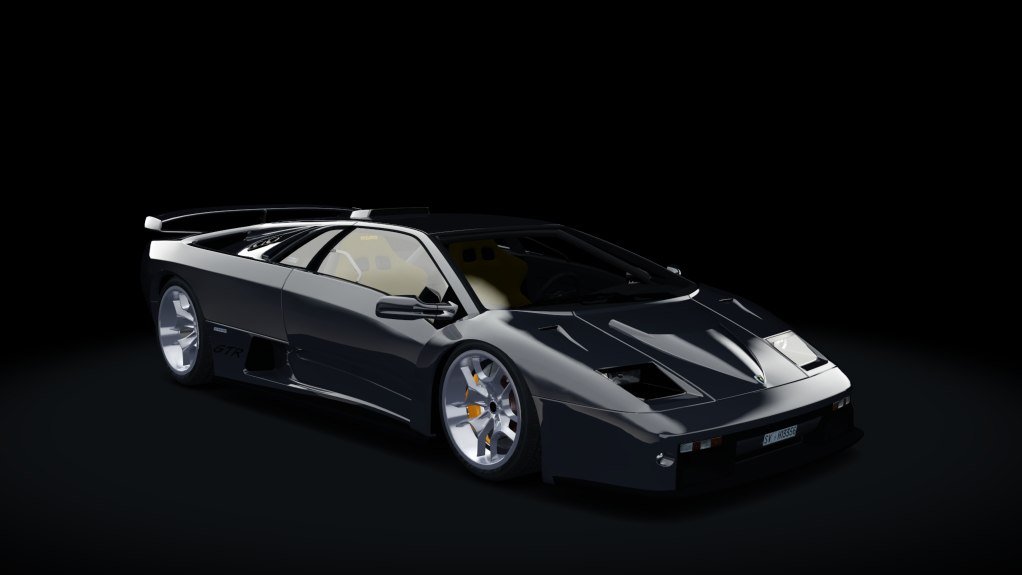
This screenshot has height=575, width=1022. Identify the location of white area curved window. (248, 250).